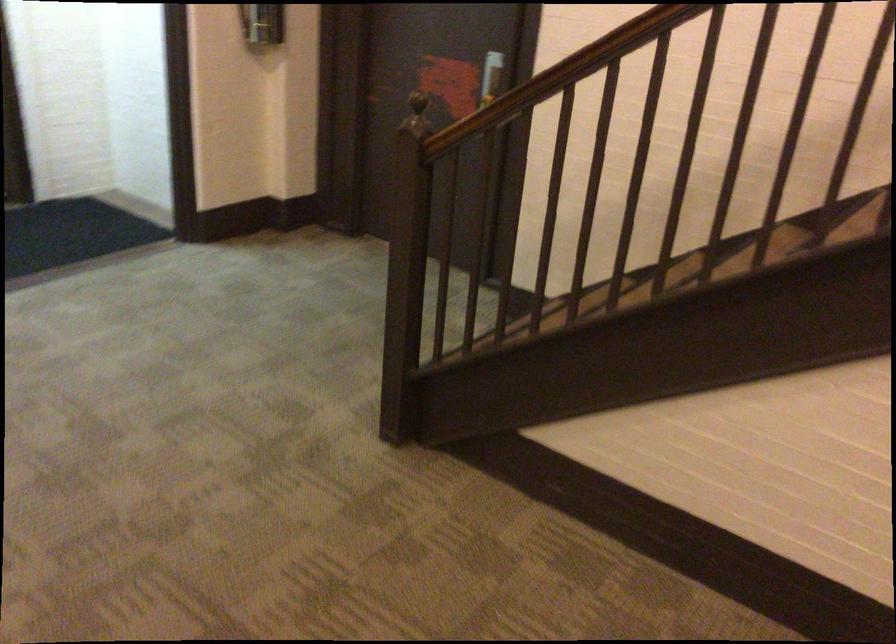
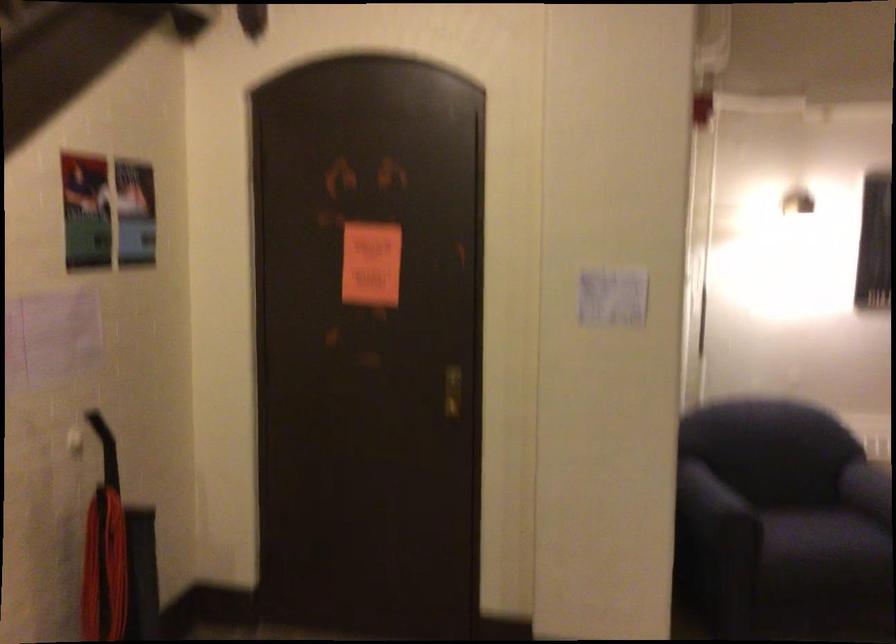
From the picture: First-person continuous shooting, in which direction is the camera rotating?

The camera's rotation is toward right-down.